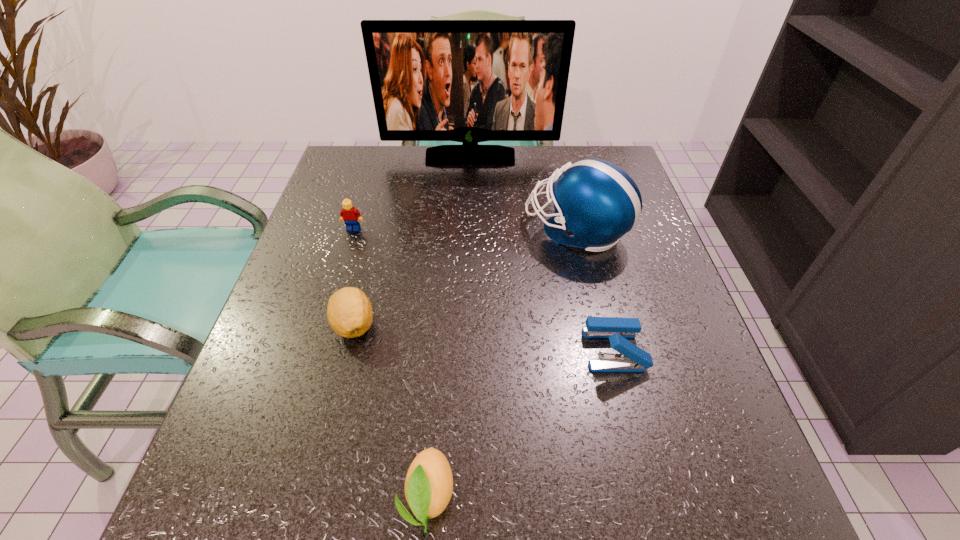
Where is `the tallest object`? the tallest object is located at coordinates (469, 81).

Locate an element on the screen. Image resolution: width=960 pixels, height=540 pixels. monitor is located at coordinates coord(469,81).

The height and width of the screenshot is (540, 960). I want to click on the fifth shortest object, so click(x=596, y=202).

Locate an element on the screen. This screenshot has height=540, width=960. Lego is located at coordinates (351, 216).

I want to click on stapler, so click(631, 358).

Locate an element on the screen. Image resolution: width=960 pixels, height=540 pixels. the farther lemon is located at coordinates (349, 312).

Find the location of a particular element. vacant space located 0.360m on the front-facing side of the monitor is located at coordinates (468, 254).

The height and width of the screenshot is (540, 960). What are the coordinates of `vacant region located at the front of the fifth shortest object with the faceguard` in the screenshot? It's located at (414, 230).

Identify the location of vacant point located 0.330m at the front of the fifth shortest object with the faceguard. (384, 230).

Locate an element on the screen. free region located at the front of the fifth shortest object with the faceguard is located at coordinates (375, 230).